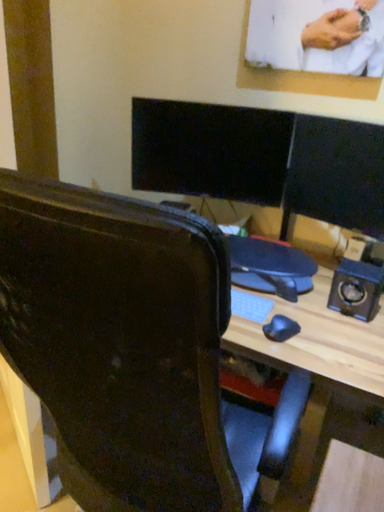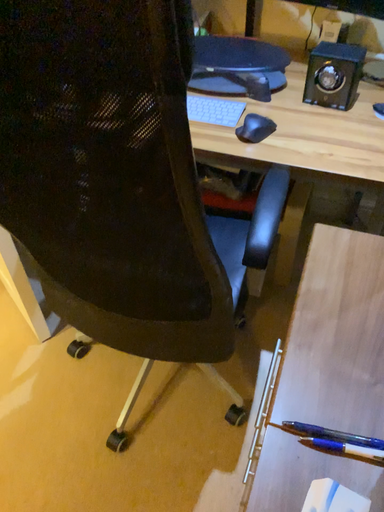
Question: How did the camera likely rotate when shooting the video?

Choices:
 (A) rotated upward
 (B) rotated downward

Answer: (B)